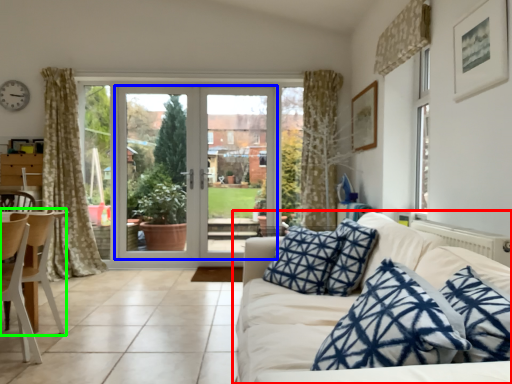
Question: Considering the real-world distances, which object is farthest from studio couch (highlighted by a red box)? door (highlighted by a blue box) or chair (highlighted by a green box)?

Choices:
 (A) door
 (B) chair

Answer: (A)